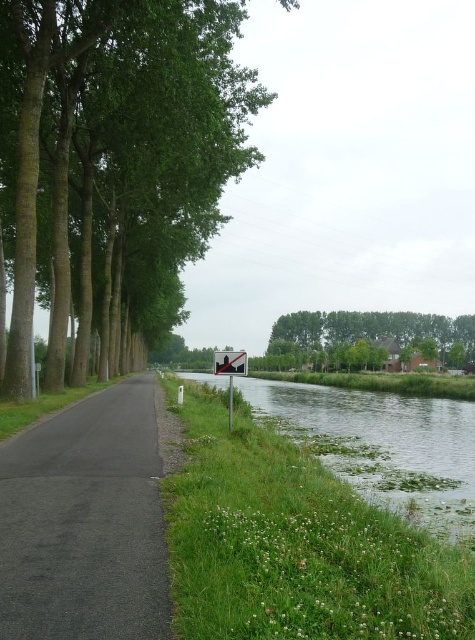
Question: Among these points, which one is nearest to the camera?

Choices:
 (A) (378, 324)
 (B) (386, 488)

Answer: (B)

Question: In this image, where is green leafy tree at center located relative to reflective glass sign at center?

Choices:
 (A) right
 (B) left

Answer: (B)

Question: Does black asphalt road at left lie behind green grassy river at center?

Choices:
 (A) yes
 (B) no

Answer: (B)

Question: Observing the image, what is the correct spatial positioning of green grassy river at center in reference to metallic reflective sign at center?

Choices:
 (A) below
 (B) above

Answer: (A)

Question: Which object is positioned farthest from the reflective glass sign at center?

Choices:
 (A) green leafy trees at center
 (B) black asphalt road at left
 (C) metallic reflective sign at center
 (D) green grassy river at center

Answer: (A)

Question: Which of the following is the farthest from the observer?

Choices:
 (A) (410, 316)
 (B) (216, 356)
 (C) (218, 360)
 (D) (53, 620)

Answer: (A)